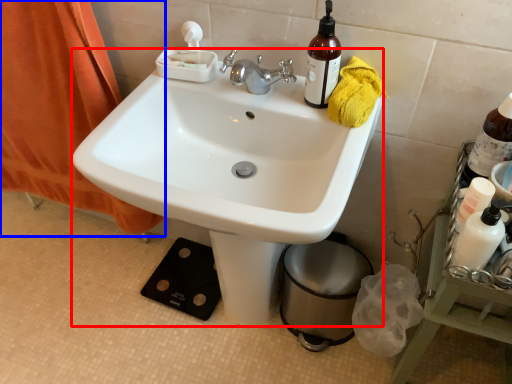
Question: Which of the following is the closest to the observer, sink (highlighted by a red box) or curtain (highlighted by a blue box)?

Choices:
 (A) sink
 (B) curtain

Answer: (A)